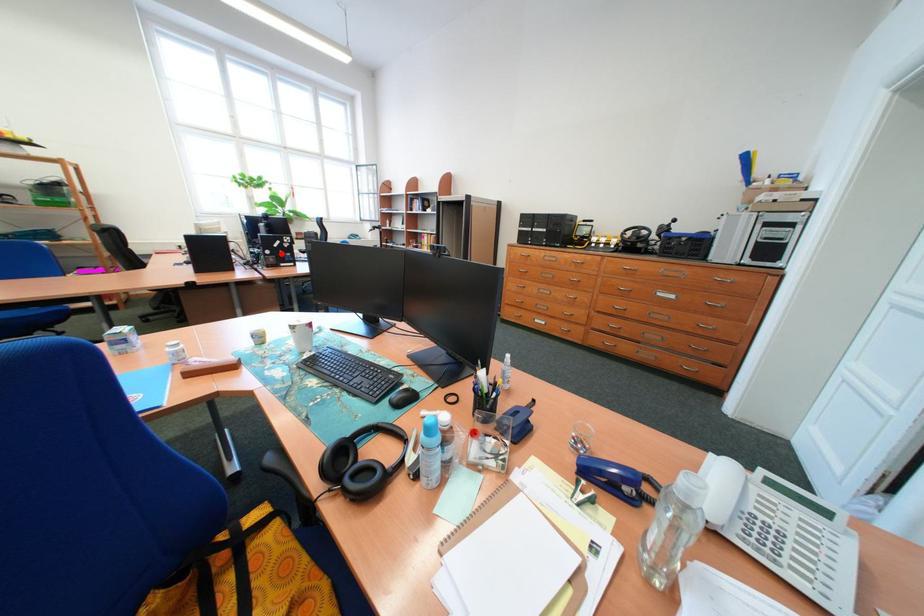
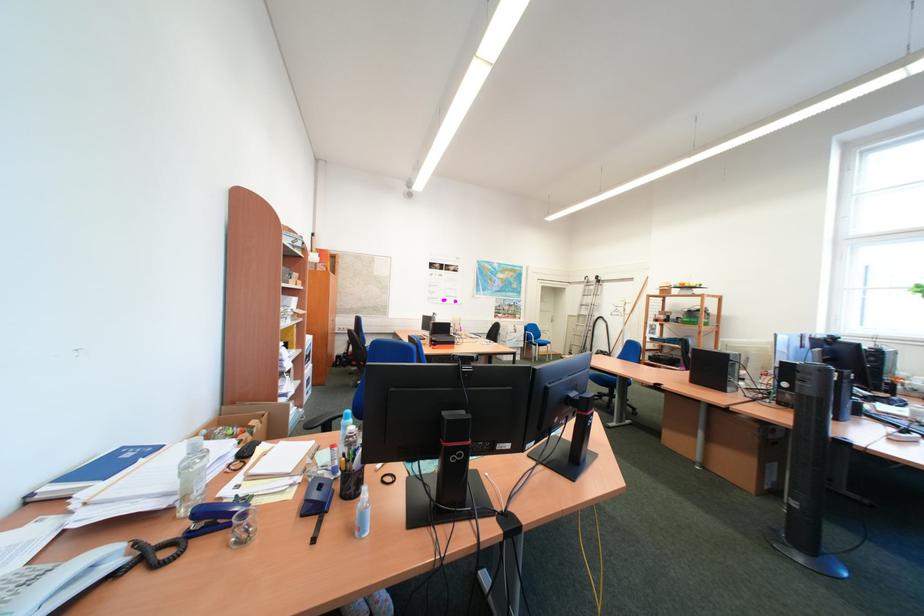
In the second image, find the point that corresponds to the highlighted location in the first image.

(798, 387)